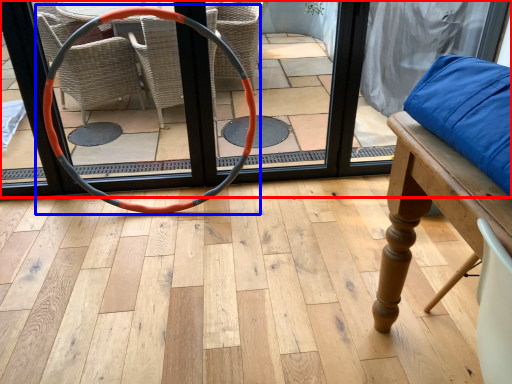
Question: Which of the following is the farthest to the observer, screen door (highlighted by a red box) or hula hoop (highlighted by a blue box)?

Choices:
 (A) screen door
 (B) hula hoop

Answer: (A)